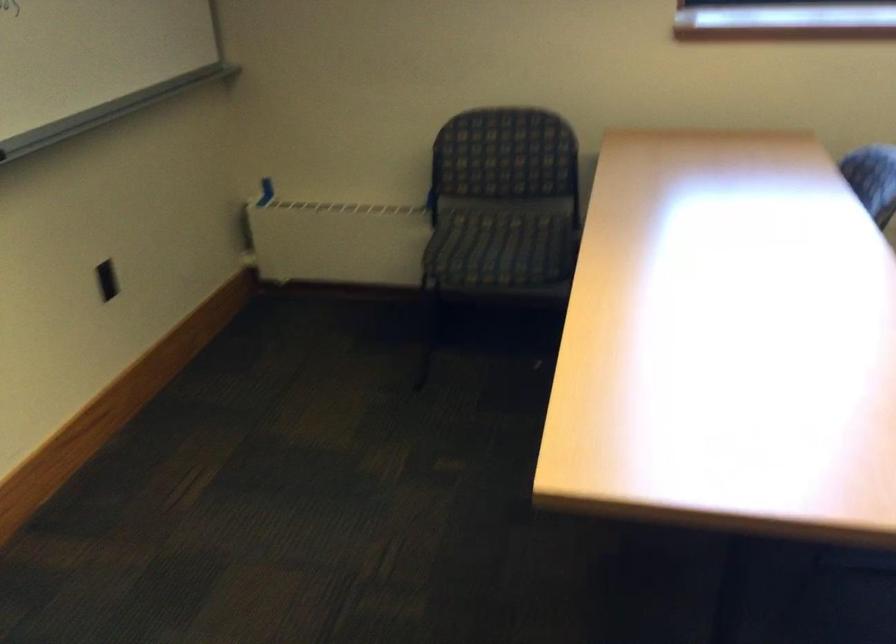
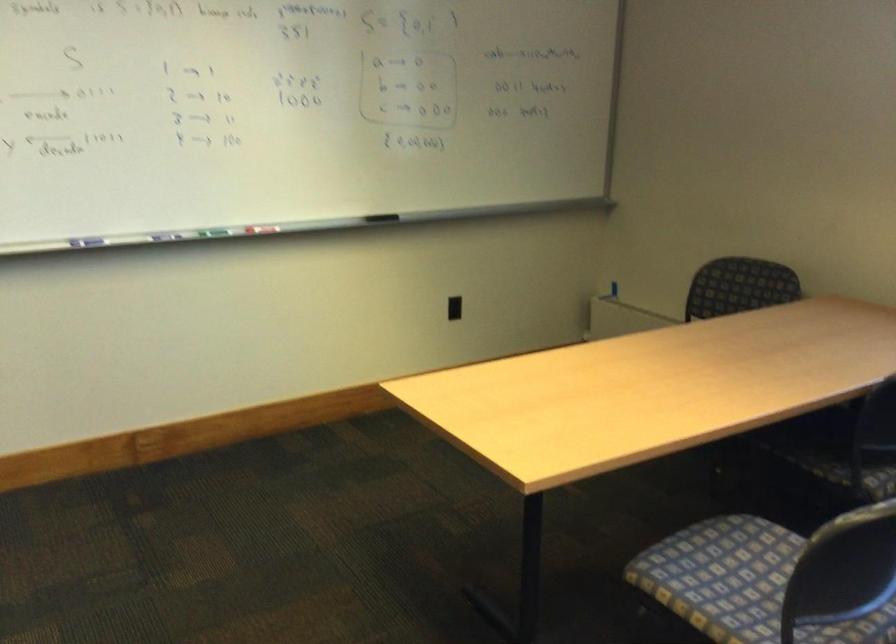
In the second image, find the point that corresponds to [130,279] in the first image.

(453, 308)